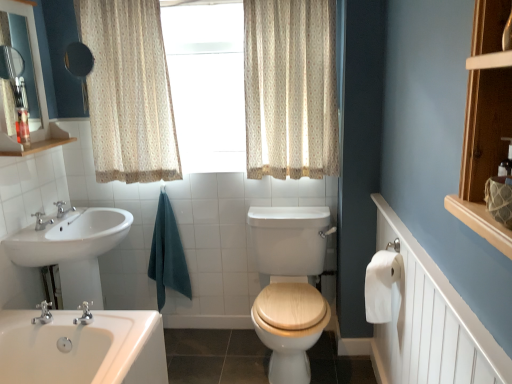
Question: From the image's perspective, is white glossy sink at lower left located beneath white textured radiator at right?

Choices:
 (A) yes
 (B) no

Answer: (B)

Question: Is white glossy sink at lower left located outside white textured radiator at right?

Choices:
 (A) yes
 (B) no

Answer: (A)

Question: Is white textured radiator at right at the back of white glossy sink at lower left?

Choices:
 (A) no
 (B) yes

Answer: (A)

Question: Are white glossy sink at lower left and white textured radiator at right located far from each other?

Choices:
 (A) yes
 (B) no

Answer: (A)

Question: Does white glossy sink at lower left touch white textured radiator at right?

Choices:
 (A) no
 (B) yes

Answer: (A)

Question: From a real-world perspective, relative to white glossy shelf at upper left, is matte black mirror at upper left vertically above or below?

Choices:
 (A) below
 (B) above

Answer: (B)

Question: Looking at the image, does matte black mirror at upper left seem bigger or smaller compared to white glossy shelf at upper left?

Choices:
 (A) small
 (B) big

Answer: (B)

Question: Considering the positions of matte black mirror at upper left and white glossy shelf at upper left in the image, is matte black mirror at upper left wider or thinner than white glossy shelf at upper left?

Choices:
 (A) thin
 (B) wide

Answer: (A)

Question: Is point (72, 74) closer or farther from the camera than point (72, 140)?

Choices:
 (A) closer
 (B) farther

Answer: (A)

Question: Does point (410, 243) appear closer or farther from the camera than point (148, 91)?

Choices:
 (A) farther
 (B) closer

Answer: (B)

Question: From a real-world perspective, is white textured radiator at right above or below beige floral fabric curtain at upper center, the first curtain positioned from the left?

Choices:
 (A) above
 (B) below

Answer: (B)

Question: Is white textured radiator at right in front of or behind beige floral fabric curtain at upper center, the 2th curtain in the right-to-left sequence, in the image?

Choices:
 (A) behind
 (B) front

Answer: (B)

Question: From the image's perspective, is white textured radiator at right above or below beige floral fabric curtain at upper center, the 2th curtain in the right-to-left sequence?

Choices:
 (A) below
 (B) above

Answer: (A)

Question: From a real-world perspective, relative to white paper at right, is beige floral fabric curtain at upper center, the 2th curtain in the right-to-left sequence, vertically above or below?

Choices:
 (A) below
 (B) above

Answer: (B)

Question: Looking at the image, does beige floral fabric curtain at upper center, the first curtain positioned from the left, seem bigger or smaller compared to white paper at right?

Choices:
 (A) small
 (B) big

Answer: (B)